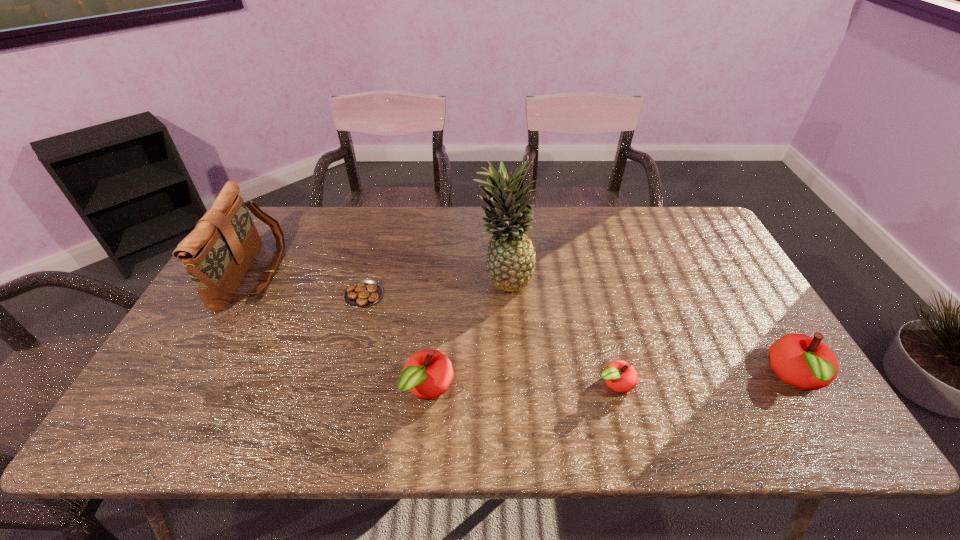
Identify which apple is the second nearest to the fifth shortest object. Please provide its 2D coordinates. Your answer should be formatted as a tuple, i.e. [(x, y)], where the tuple contains the x and y coordinates of a point satisfying the conditions above.

[(621, 377)]

I want to click on free location that satisfies the following two spatial constraints: 1. on the back side of the rightmost apple; 2. on the front-facing side of the fifth shortest object, so 732,274.

You are a GUI agent. You are given a task and a screenshot of the screen. Output one action in this format:
    pyautogui.click(x=<x>, y=<y>)
    Task: Click on the blank area in the image that satisfies the following two spatial constraints: 1. on the front-facing side of the fourth object from left to right; 2. on the right side of the second tallest object
    This screenshot has height=540, width=960.
    Given the screenshot: What is the action you would take?
    pyautogui.click(x=251, y=277)

At what (x,y) coordinates should I click in order to perform the action: click on vacant space that satisfies the following two spatial constraints: 1. on the front-facing side of the fifth tallest object; 2. on the right side of the leftmost object. Please return your answer as a coordinate pair (x, y). This screenshot has height=540, width=960. Looking at the image, I should click on (191, 383).

Where is `vacant area that satisfies the following two spatial constraints: 1. on the front side of the shortest object; 2. on the right side of the third object from left to right`? Image resolution: width=960 pixels, height=540 pixels. vacant area that satisfies the following two spatial constraints: 1. on the front side of the shortest object; 2. on the right side of the third object from left to right is located at coordinates (338, 388).

Where is `vacant area that satisfies the following two spatial constraints: 1. on the front-facing side of the shortest object; 2. on the left side of the second tallest object`? The width and height of the screenshot is (960, 540). vacant area that satisfies the following two spatial constraints: 1. on the front-facing side of the shortest object; 2. on the left side of the second tallest object is located at coordinates (240, 295).

This screenshot has height=540, width=960. What are the coordinates of `vacant space that satisfies the following two spatial constraints: 1. on the front-facing side of the leftmost object; 2. on the left side of the fifth object from left to right` in the screenshot? It's located at (191, 383).

In order to click on free space that satisfies the following two spatial constraints: 1. on the front-facing side of the rightmost apple; 2. on the left side of the leftmost object in this screenshot , I will do `click(194, 378)`.